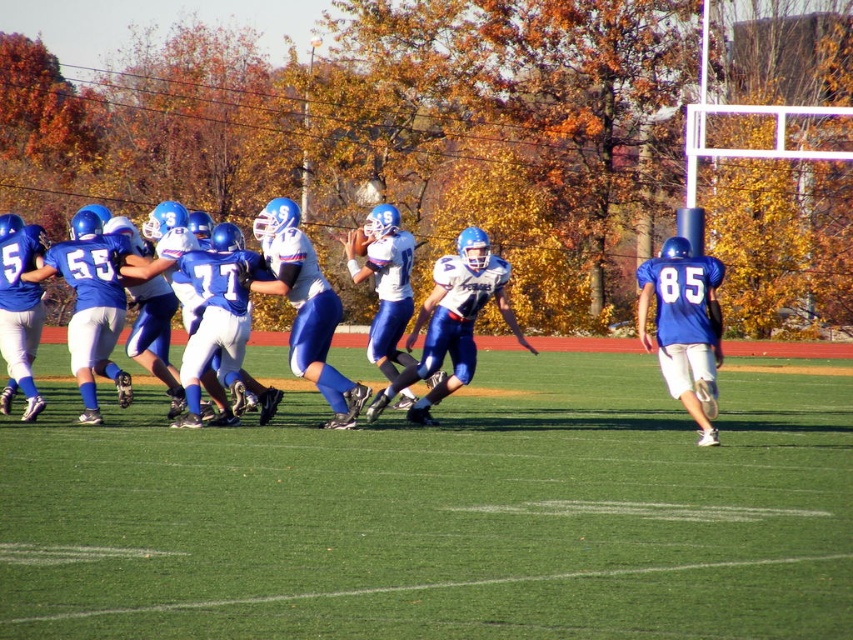
You are a spectator sitting in the stands watching the game. You notice the green grass at center and the matte blue uniform at center. Which one appears nearer to you?

The green grass at center is closer to the viewer than the matte blue uniform at center, so the green grass at center appears nearer.

Looking at this image, you are a sports analyst watching the game. You notice the green grass at center and the matte blue uniform at center. Which one is positioned lower in the image?

The green grass at center is located below the matte blue uniform at center, so the green grass at center is positioned lower in the image.

You are a sports analyst watching the game. You notice the green grass at center and the matte blue uniform at center. Which one is taller?

The matte blue uniform at center is taller than the green grass at center.